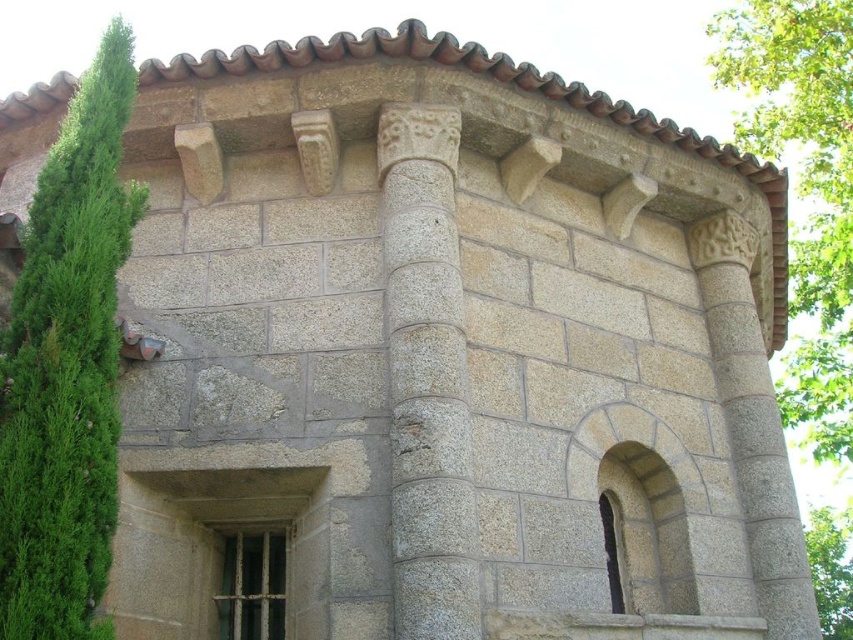
Can you confirm if gray stone column at center is shorter than green leafy tree at upper right?

Correct, gray stone column at center is not as tall as green leafy tree at upper right.

Does gray stone column at center have a smaller size compared to green leafy tree at upper right?

Yes, gray stone column at center is smaller than green leafy tree at upper right.

Does point (425, 275) lie in front of point (851, 448)?

Yes, point (425, 275) is in front of point (851, 448).

You are a GUI agent. You are given a task and a screenshot of the screen. Output one action in this format:
    pyautogui.click(x=<x>, y=<y>)
    Task: Click on the gray stone column at center
    
    Given the screenshot: What is the action you would take?
    pyautogui.click(x=427, y=378)

Does green leafy tree at left appear on the left side of gray stone column at center?

Yes, green leafy tree at left is to the left of gray stone column at center.

Identify the location of green leafy tree at left. This screenshot has width=853, height=640. (67, 368).

Which is in front, point (108, 483) or point (434, 502)?

Point (108, 483)

Identify the location of green leafy tree at left. (67, 368).

Is point (3, 529) closer to viewer compared to point (811, 92)?

Yes, it is.

Between green leafy tree at left and green leafy tree at upper right, which one has more height?

Standing taller between the two is green leafy tree at upper right.

Find the location of a particular element. The image size is (853, 640). green leafy tree at left is located at coordinates (67, 368).